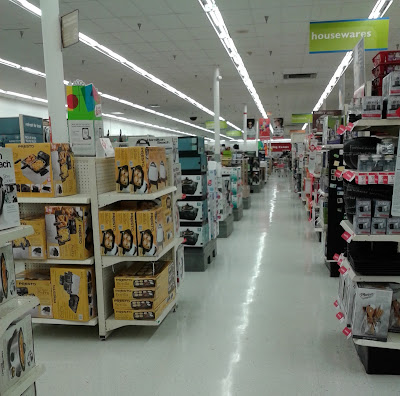
Where is `light reflections on white flooring`? The image size is (400, 396). light reflections on white flooring is located at coordinates (262, 250), (271, 210), (247, 302).